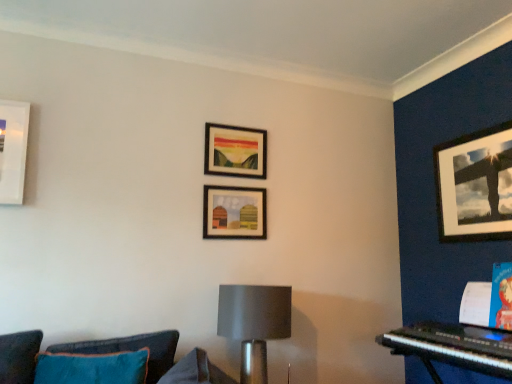
Question: Can you confirm if matte black picture frame at upper right, the first picture frame from the right, is thinner than teal fabric couch at lower left?

Choices:
 (A) no
 (B) yes

Answer: (B)

Question: Is matte black picture frame at upper right, the third picture frame in the left-to-right sequence, to the right of teal fabric couch at lower left from the viewer's perspective?

Choices:
 (A) no
 (B) yes

Answer: (B)

Question: Would you say matte black picture frame at upper right, the first picture frame from the right, contains teal fabric couch at lower left?

Choices:
 (A) no
 (B) yes

Answer: (A)

Question: From a real-world perspective, is matte black picture frame at upper right, the third picture frame in the left-to-right sequence, positioned under teal fabric couch at lower left based on gravity?

Choices:
 (A) yes
 (B) no

Answer: (B)

Question: Does matte black picture frame at upper right, the third picture frame in the left-to-right sequence, have a lesser height compared to teal fabric couch at lower left?

Choices:
 (A) no
 (B) yes

Answer: (A)

Question: From the image's perspective, is matte black picture frame at upper center, the first picture frame from the left, above or below matte wooden picture frame at center, positioned as the second picture frame in right-to-left order?

Choices:
 (A) above
 (B) below

Answer: (A)

Question: In terms of size, does matte black picture frame at upper center, the first picture frame from the left, appear bigger or smaller than matte wooden picture frame at center, positioned as the second picture frame in right-to-left order?

Choices:
 (A) small
 (B) big

Answer: (B)

Question: Is matte black picture frame at upper center, the first picture frame from the left, situated inside matte wooden picture frame at center, which appears as the 2th picture frame when viewed from the left, or outside?

Choices:
 (A) inside
 (B) outside

Answer: (B)

Question: From a real-world perspective, is matte black picture frame at upper center, acting as the 3th picture frame starting from the right, physically located above or below matte wooden picture frame at center, which appears as the 2th picture frame when viewed from the left?

Choices:
 (A) below
 (B) above

Answer: (B)

Question: In terms of height, does matte gray lampshade at center look taller or shorter compared to teal fabric couch at lower left?

Choices:
 (A) tall
 (B) short

Answer: (A)

Question: Does point (232, 297) appear closer or farther from the camera than point (131, 345)?

Choices:
 (A) farther
 (B) closer

Answer: (A)

Question: In terms of width, does matte gray lampshade at center look wider or thinner when compared to teal fabric couch at lower left?

Choices:
 (A) wide
 (B) thin

Answer: (A)

Question: Would you say matte gray lampshade at center is inside or outside teal fabric couch at lower left?

Choices:
 (A) outside
 (B) inside

Answer: (A)

Question: Is matte black picture frame at upper center, the first picture frame from the left, taller or shorter than black plastic keyboard at lower right?

Choices:
 (A) tall
 (B) short

Answer: (A)

Question: From a real-world perspective, is matte black picture frame at upper center, acting as the 3th picture frame starting from the right, above or below black plastic keyboard at lower right?

Choices:
 (A) below
 (B) above

Answer: (B)